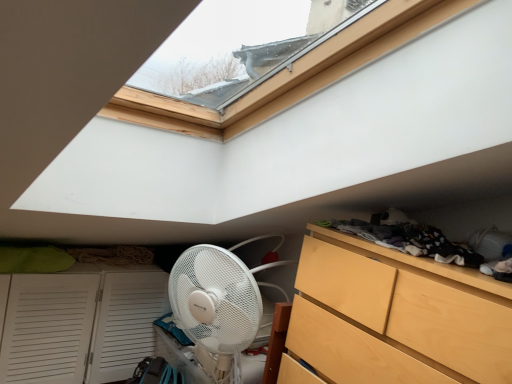
Measure the distance between point (444, 236) and camera.

They are 1.44 meters apart.

What do you see at coordinates (80, 324) in the screenshot? The image size is (512, 384). I see `white louvered cupboard at lower left` at bounding box center [80, 324].

Find the location of a particular element. light wood dresser at lower right is located at coordinates (396, 316).

Identify the location of dark gray fabric at upper right. (421, 243).

From the image's perspective, is light wood dresser at lower right located beneath white louvered cupboard at lower left?

No, from the image's perspective, light wood dresser at lower right is not beneath white louvered cupboard at lower left.

Is white louvered cupboard at lower left surrounded by light wood dresser at lower right?

No, white louvered cupboard at lower left is not surrounded by light wood dresser at lower right.

What's the angular difference between light wood dresser at lower right and white louvered cupboard at lower left's facing directions?

90.8 degrees.

Between light wood dresser at lower right and white louvered cupboard at lower left, which one has larger width?

With larger width is light wood dresser at lower right.

Considering the sizes of white louvered cupboard at lower left and light wood dresser at lower right in the image, is white louvered cupboard at lower left bigger or smaller than light wood dresser at lower right?

white louvered cupboard at lower left is bigger than light wood dresser at lower right.

Measure the distance between white louvered cupboard at lower left and light wood dresser at lower right.

4.24 feet.

Would you say white louvered cupboard at lower left is a long distance from light wood dresser at lower right?

white louvered cupboard at lower left is positioned a significant distance from light wood dresser at lower right.

Is white louvered cupboard at lower left taller or shorter than light wood dresser at lower right?

Considering their sizes, white louvered cupboard at lower left has more height than light wood dresser at lower right.

Is dark gray fabric at upper right inside or outside of light wood dresser at lower right?

dark gray fabric at upper right cannot be found inside light wood dresser at lower right.

You are a GUI agent. You are given a task and a screenshot of the screen. Output one action in this format:
    pyautogui.click(x=<x>, y=<y>)
    Task: Click on the laundry that appears above the light wood dresser at lower right (from a real-world perspective)
    The height and width of the screenshot is (384, 512).
    Given the screenshot: What is the action you would take?
    pyautogui.click(x=421, y=243)

Is point (446, 256) positioned after point (406, 351)?

That is False.

You are a GUI agent. You are given a task and a screenshot of the screen. Output one action in this format:
    pyautogui.click(x=<x>, y=<y>)
    Task: Click on the laundry to the right of light wood dresser at lower right
    This screenshot has height=384, width=512.
    Given the screenshot: What is the action you would take?
    pyautogui.click(x=421, y=243)

Between point (474, 365) and point (373, 233), which one is positioned behind?

The point (373, 233) is farther from the camera.

Consider the image. From their relative heights in the image, would you say light wood dresser at lower right is taller or shorter than dark gray fabric at upper right?

Clearly, light wood dresser at lower right is taller compared to dark gray fabric at upper right.

Is light wood dresser at lower right smaller than dark gray fabric at upper right?

Incorrect, light wood dresser at lower right is not smaller in size than dark gray fabric at upper right.

Choose the correct answer: Is dark gray fabric at upper right inside white louvered cupboard at lower left or outside it?

The correct answer is: outside.

Does dark gray fabric at upper right turn towards white louvered cupboard at lower left?

No, dark gray fabric at upper right is not oriented towards white louvered cupboard at lower left.

Is dark gray fabric at upper right to the right of white louvered cupboard at lower left from the viewer's perspective?

Yes, dark gray fabric at upper right is to the right of white louvered cupboard at lower left.

Looking at this image, from a real-world perspective, is dark gray fabric at upper right above or below white louvered cupboard at lower left?

In terms of real-world spatial position, dark gray fabric at upper right is above white louvered cupboard at lower left.

From a real-world perspective, between white louvered cupboard at lower left and dark gray fabric at upper right, who is vertically lower?

From a 3D spatial view, white louvered cupboard at lower left is below.

Is white louvered cupboard at lower left inside the boundaries of dark gray fabric at upper right, or outside?

white louvered cupboard at lower left is outside dark gray fabric at upper right.

Image resolution: width=512 pixels, height=384 pixels. Find the location of `the chest of drawers located above the white louvered cupboard at lower left (from a real-world perspective)`. the chest of drawers located above the white louvered cupboard at lower left (from a real-world perspective) is located at coordinates (396, 316).

What are the coordinates of `cupboard directly beneath the light wood dresser at lower right (from a real-world perspective)` in the screenshot? It's located at (80, 324).

When comparing their distances from dark gray fabric at upper right, does light wood dresser at lower right or white louvered cupboard at lower left seem further?

white louvered cupboard at lower left lies further to dark gray fabric at upper right than the other object.

Based on their spatial positions, is dark gray fabric at upper right or white louvered cupboard at lower left closer to light wood dresser at lower right?

dark gray fabric at upper right is closer to light wood dresser at lower right.

Which object lies nearer to the anchor point white louvered cupboard at lower left, light wood dresser at lower right or dark gray fabric at upper right?

light wood dresser at lower right is positioned closer to the anchor white louvered cupboard at lower left.

Based on their spatial positions, is white louvered cupboard at lower left or dark gray fabric at upper right closer to light wood dresser at lower right?

dark gray fabric at upper right.

Estimate the real-world distances between objects in this image. Which object is closer to dark gray fabric at upper right, white louvered cupboard at lower left or light wood dresser at lower right?

light wood dresser at lower right is closer to dark gray fabric at upper right.

Looking at the image, which one is located closer to white louvered cupboard at lower left, dark gray fabric at upper right or light wood dresser at lower right?

light wood dresser at lower right lies closer to white louvered cupboard at lower left than the other object.

You are a GUI agent. You are given a task and a screenshot of the screen. Output one action in this format:
    pyautogui.click(x=<x>, y=<y>)
    Task: Click on the chest of drawers situated between white louvered cupboard at lower left and dark gray fabric at upper right from left to right
    The width and height of the screenshot is (512, 384).
    Given the screenshot: What is the action you would take?
    pyautogui.click(x=396, y=316)